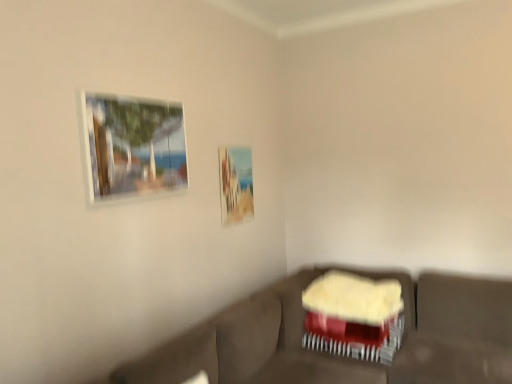
Question: Is matte glass picture frame at upper left, the 1th picture frame positioned from the left, at the back of velvet red swivel chair at lower right?

Choices:
 (A) no
 (B) yes

Answer: (A)

Question: Considering the relative sizes of velvet red swivel chair at lower right and matte glass picture frame at upper left, the 1th picture frame positioned from the front, in the image provided, is velvet red swivel chair at lower right smaller than matte glass picture frame at upper left, the 1th picture frame positioned from the front,?

Choices:
 (A) no
 (B) yes

Answer: (A)

Question: Is velvet red swivel chair at lower right shorter than matte glass picture frame at upper left, the second picture frame when ordered from back to front?

Choices:
 (A) yes
 (B) no

Answer: (A)

Question: Could you tell me if velvet red swivel chair at lower right is turned towards matte glass picture frame at upper left, the 1th picture frame positioned from the left?

Choices:
 (A) no
 (B) yes

Answer: (A)

Question: Is velvet red swivel chair at lower right positioned behind matte glass picture frame at upper left, the 1th picture frame positioned from the front?

Choices:
 (A) yes
 (B) no

Answer: (A)

Question: Is velvet brown couch at lower center wider or thinner than velvet red swivel chair at lower right?

Choices:
 (A) wide
 (B) thin

Answer: (A)

Question: Is velvet brown couch at lower center to the left or to the right of velvet red swivel chair at lower right in the image?

Choices:
 (A) right
 (B) left

Answer: (B)

Question: Which is correct: velvet brown couch at lower center is inside velvet red swivel chair at lower right, or outside of it?

Choices:
 (A) inside
 (B) outside

Answer: (B)

Question: Considering the positions of velvet brown couch at lower center and velvet red swivel chair at lower right in the image, is velvet brown couch at lower center bigger or smaller than velvet red swivel chair at lower right?

Choices:
 (A) small
 (B) big

Answer: (B)

Question: Which is correct: velvet red swivel chair at lower right is inside matte glass picture frame at upper left, the second picture frame when ordered from back to front, or outside of it?

Choices:
 (A) outside
 (B) inside

Answer: (A)

Question: Based on their positions, is velvet red swivel chair at lower right located to the left or right of matte glass picture frame at upper left, the 1th picture frame positioned from the front?

Choices:
 (A) left
 (B) right

Answer: (B)

Question: In terms of height, does velvet red swivel chair at lower right look taller or shorter compared to matte glass picture frame at upper left, the 1th picture frame positioned from the front?

Choices:
 (A) tall
 (B) short

Answer: (B)

Question: From a real-world perspective, is velvet red swivel chair at lower right above or below matte glass picture frame at upper left, the second picture frame positioned from the right?

Choices:
 (A) below
 (B) above

Answer: (A)

Question: Is point (227, 221) positioned closer to the camera than point (101, 145)?

Choices:
 (A) closer
 (B) farther

Answer: (B)

Question: Is matte wooden picture frame at upper center, the first picture frame positioned from the right, wider or thinner than matte glass picture frame at upper left, the 1th picture frame positioned from the left?

Choices:
 (A) wide
 (B) thin

Answer: (B)